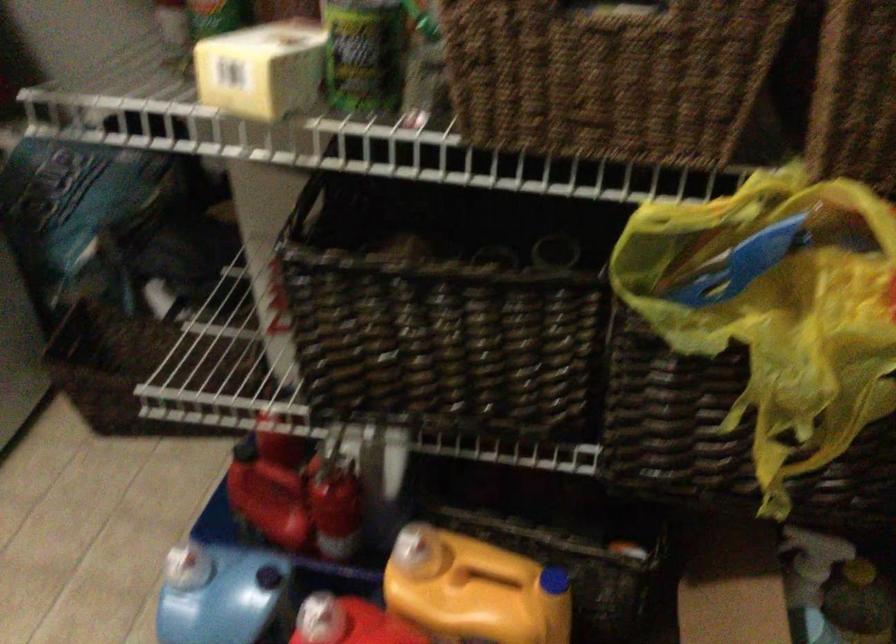
What are the coordinates of `yellow jug handle` in the screenshot? It's located at (409, 550).